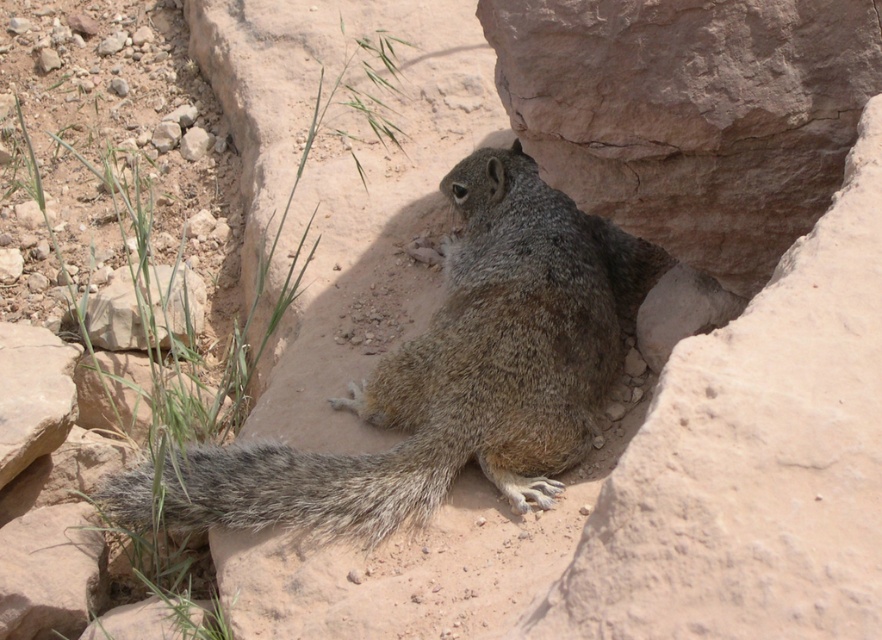
You are a hiker who has spotted a gray squirrel in a rocky area. You want to take a photo of the squirrel but need to ensure you are within the camera frame. The camera has a rectangular frame with a center point marked at coordinates point (458, 372). Where is the gray squirrel located relative to this center point?

The gray squirrel at center is located exactly at the center point marked by the camera frame, so it is perfectly centered within the frame.